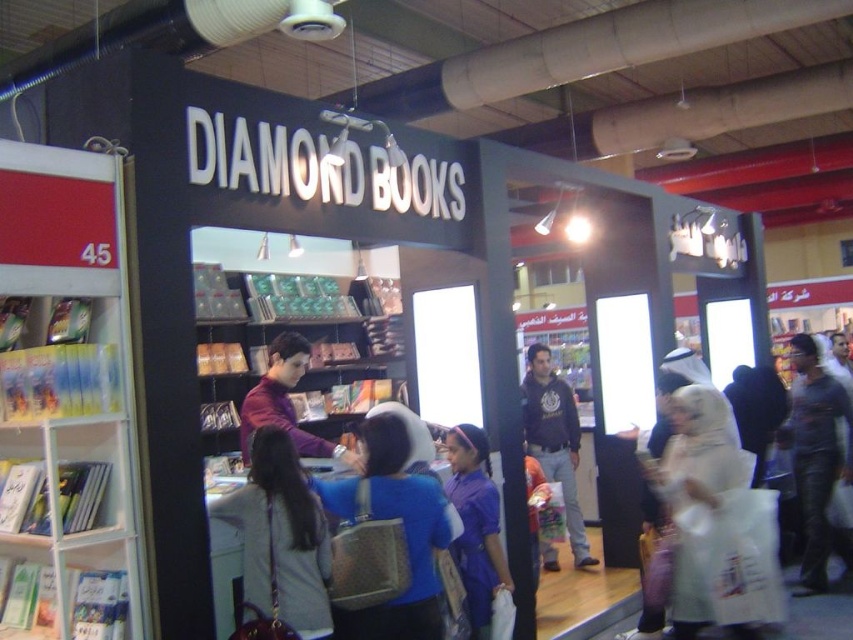
You are a delivery person carrying a box that is 2 meters long. You need to place it in the white plastic bookshelf at left. Is the bookshelf long enough to accommodate the box?

The distance between the white plastic bookshelf at left and the camera is 2.36 meters. Since the box is 2 meters long, the bookshelf is long enough to accommodate the box as it is slightly longer than the box.

You are standing at the entrance of the booth and want to locate the white plastic bookshelf at left. According to the coordinates provided, where should you look relative to your current position?

The white plastic bookshelf at left is located at the lower left side of the booth, so you should look to your left and slightly downward from your current position at the entrance.

You are a visitor at the book fair and want to pick up the leather jacket at center. However, there is a white plastic bookshelf at left blocking your path. Can you walk around the bookshelf to reach the jacket?

The white plastic bookshelf at left is to the left of the leather jacket at center, so you can walk around the bookshelf to your right to reach the jacket.